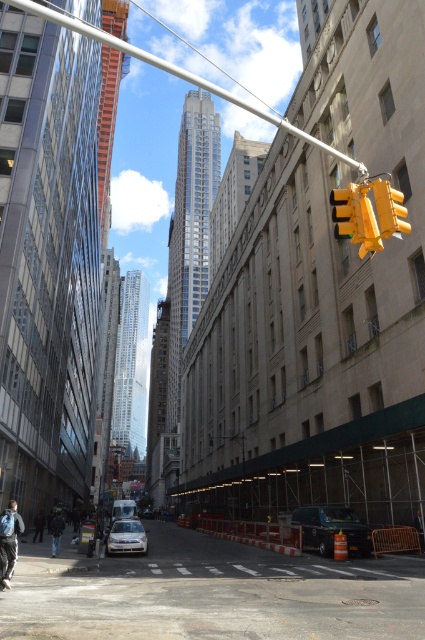
You are a delivery person trying to navigate through the busy street. You see the metallic silver pole at upper center and the black rubber van at lower center. Which object is closer to the left side of the street?

The metallic silver pole at upper center is positioned on the left side of the black rubber van at lower center, so it is closer to the left side of the street.

You are a pedestrian on the street and notice the metallic silver pole at upper center and the black rubber van at lower center. Which object is closer to you from your vantage point?

The metallic silver pole at upper center is closer to you because it is in front of the black rubber van at lower center.